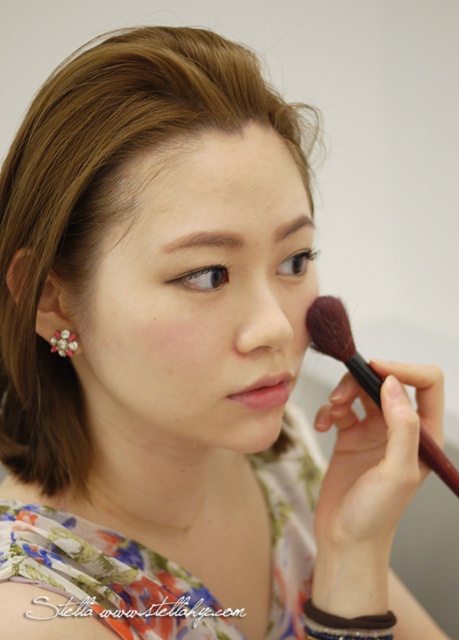
Question: Which point is farther to the camera?

Choices:
 (A) smooth skin at center
 (B) brown wooden brush at right
 (C) pearlelegantearring at left
 (D) matte pink lipstick at lower right

Answer: (C)

Question: Does brown wooden brush at right have a lesser width compared to pearlelegantearring at left?

Choices:
 (A) no
 (B) yes

Answer: (A)

Question: Which point is farther to the camera?

Choices:
 (A) (438, 470)
 (B) (263, 259)

Answer: (A)

Question: Does smooth skin at center come in front of matte pink lipstick at lower right?

Choices:
 (A) yes
 (B) no

Answer: (A)

Question: Estimate the real-world distances between objects in this image. Which object is closer to the matte pink lipstick at lower right?

Choices:
 (A) brown wooden brush at right
 (B) smooth skin at center

Answer: (A)

Question: Is brown wooden brush at right wider than pearlelegantearring at left?

Choices:
 (A) no
 (B) yes

Answer: (B)